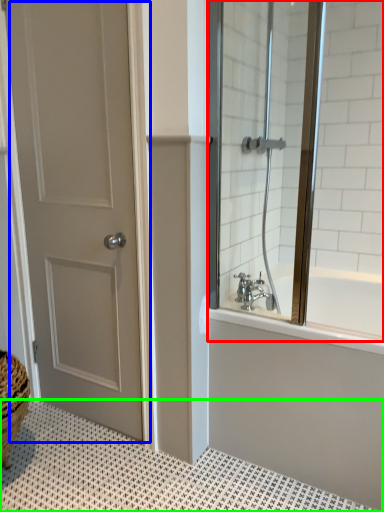
Question: Based on their relative distances, which object is nearer to window screen (highlighted by a red box)? Choose from door (highlighted by a blue box) and bath mat (highlighted by a green box).

Choices:
 (A) door
 (B) bath mat

Answer: (A)